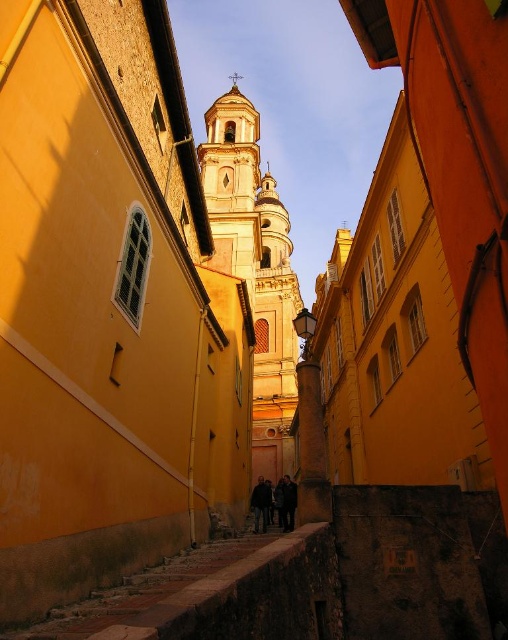
Question: Is dark gray fabric coat at center positioned before dark blue jeans at center?

Choices:
 (A) yes
 (B) no

Answer: (A)

Question: Which point appears farthest from the camera in this image?

Choices:
 (A) (261, 449)
 (B) (287, 481)
 (C) (289, 520)
 (D) (258, 492)

Answer: (A)

Question: Among these objects, which one is farthest from the camera?

Choices:
 (A) smooth gold tower at center
 (B) dark gray fabric coat at center
 (C) dark blue jeans at center

Answer: (A)

Question: Which point is farther from the camera taking this photo?

Choices:
 (A) (291, 506)
 (B) (290, 484)
 (C) (226, 109)

Answer: (C)

Question: Can you confirm if smooth gold tower at center is positioned to the left of dark clothing figure at center?

Choices:
 (A) no
 (B) yes

Answer: (B)

Question: Can you confirm if smooth gold tower at center is wider than dark gray fabric coat at center?

Choices:
 (A) yes
 (B) no

Answer: (A)